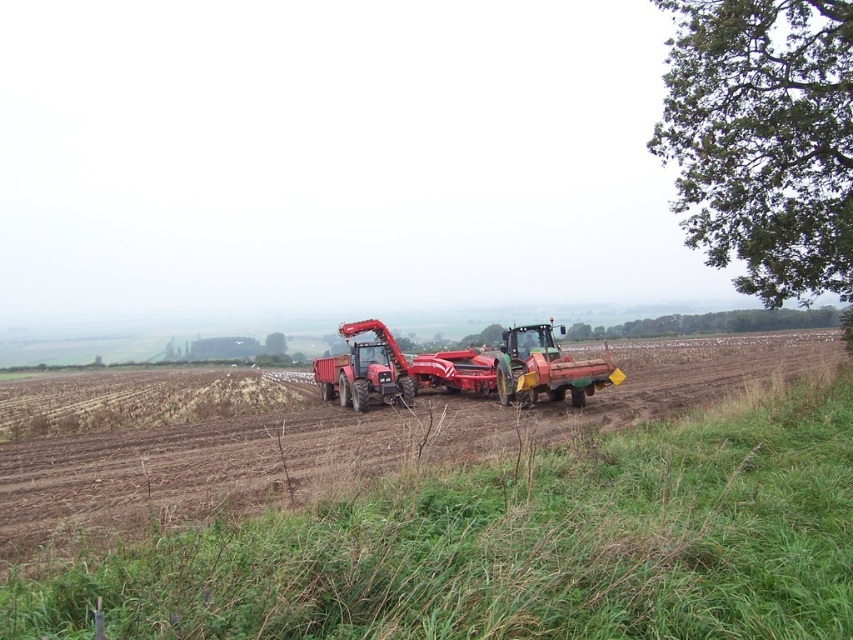
You are a drone operator trying to capture aerial footage of the farming scene. You need to ensure that the green grass at lower right is visible in the frame. Based on its coordinates, where should you position the camera to include it?

To include the green grass at lower right in the frame, position the camera so that it captures the area around coordinates point (x=515, y=545).

You are standing at the center of the field looking towards the tractors. Which direction should you walk to reach the green grass at lower right?

You should walk towards the lower right direction to reach the green grass at lower right as it is located at point (515, 545) which is in the lower right area of the image.